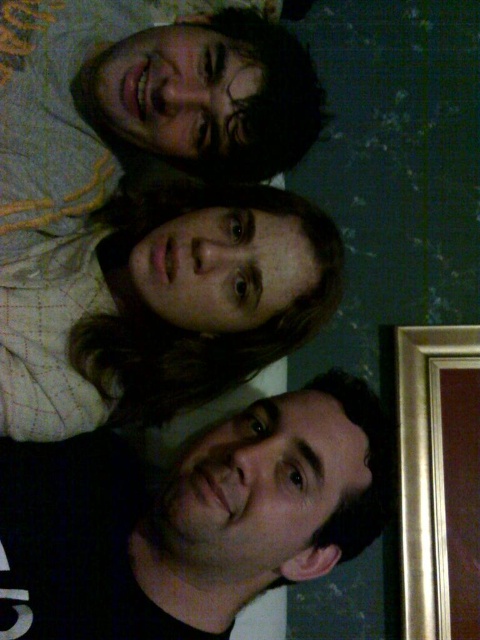
Question: Is black matte shirt at lower left thinner than matte white shirt at center?

Choices:
 (A) no
 (B) yes

Answer: (A)

Question: Based on their relative distances, which object is nearer to the black matte shirt at lower left?

Choices:
 (A) gold metallic picture frame at right
 (B) matte white shirt at center

Answer: (B)

Question: Is black matte shirt at lower left below matte white shirt at center?

Choices:
 (A) yes
 (B) no

Answer: (A)

Question: Which point appears closest to the camera in this image?

Choices:
 (A) (444, 547)
 (B) (320, 570)
 (C) (11, 410)

Answer: (C)

Question: Can you confirm if black matte shirt at lower left is positioned to the right of gold metallic picture frame at right?

Choices:
 (A) no
 (B) yes

Answer: (A)

Question: Which point is farther to the camera?

Choices:
 (A) (450, 509)
 (B) (17, 632)
 (C) (302, 228)

Answer: (A)